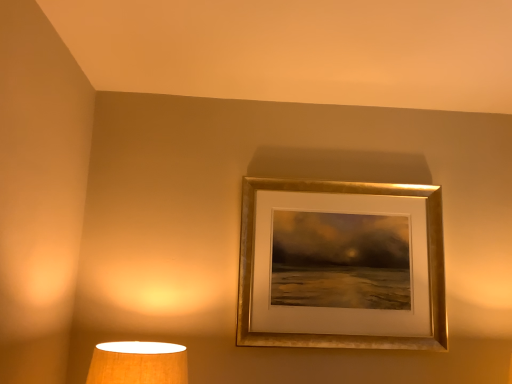
You are a GUI agent. You are given a task and a screenshot of the screen. Output one action in this format:
    pyautogui.click(x=<x>, y=<y>)
    Task: Click on the gold metallic picture frame at upper center
    
    Given the screenshot: What is the action you would take?
    pyautogui.click(x=343, y=335)

Based on the photo, measure the distance between point (x=352, y=182) and camera.

The depth of point (x=352, y=182) is 1.88 meters.

Measure the distance between gold metallic picture frame at upper center and camera.

5.67 feet.

Describe the element at coordinates (343, 335) in the screenshot. I see `gold metallic picture frame at upper center` at that location.

This screenshot has height=384, width=512. What are the coordinates of `gold metallic picture frame at upper center` in the screenshot? It's located at (343, 335).